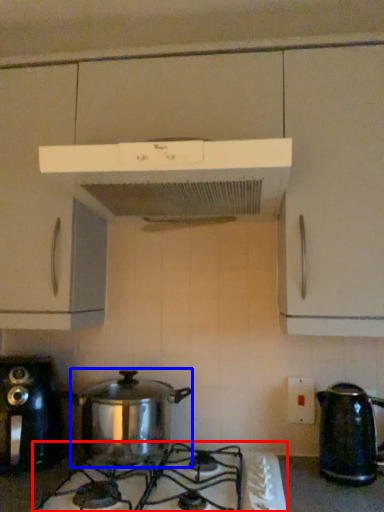
Question: Which object appears farthest to the camera in this image, gas stove (highlighted by a red box) or crock pot (highlighted by a blue box)?

Choices:
 (A) gas stove
 (B) crock pot

Answer: (B)